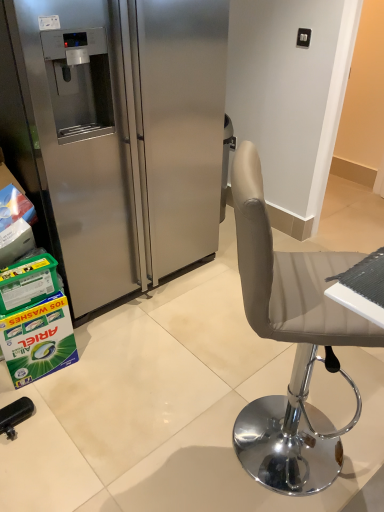
You are a GUI agent. You are given a task and a screenshot of the screen. Output one action in this format:
    pyautogui.click(x=<x>, y=<y>)
    Task: Click on the free space above green plastic container at lower left, the first box positioned from the top (from a real-world perspective)
    
    Given the screenshot: What is the action you would take?
    pyautogui.click(x=27, y=263)